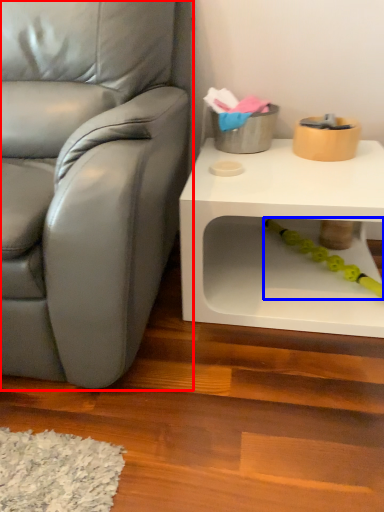
Question: Which object appears closest to the camera in this image, chair (highlighted by a red box) or toy (highlighted by a blue box)?

Choices:
 (A) chair
 (B) toy

Answer: (A)